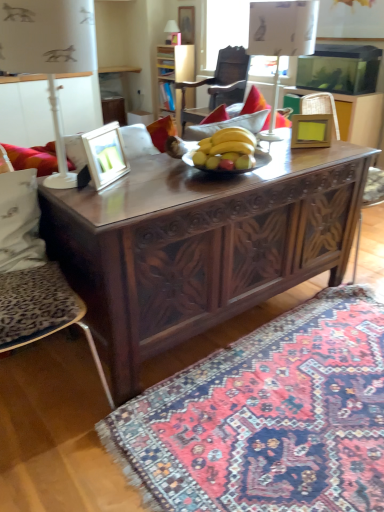
Question: Is white plastic lamp at left, placed as the 3th lamp when sorted from back to front, wider than carpet with intricate patterns at lower right?

Choices:
 (A) yes
 (B) no

Answer: (B)

Question: Is carpet with intricate patterns at lower right at the back of white plastic lamp at left, which appears as the 1th lamp when viewed from the front?

Choices:
 (A) yes
 (B) no

Answer: (B)

Question: Would you say white plastic lamp at left, placed as the 3th lamp when sorted from back to front, contains carpet with intricate patterns at lower right?

Choices:
 (A) yes
 (B) no

Answer: (B)

Question: From a real-world perspective, is white plastic lamp at left, which ranks as the third lamp in top-to-bottom order, on top of carpet with intricate patterns at lower right?

Choices:
 (A) yes
 (B) no

Answer: (A)

Question: Considering the relative positions of white plastic lamp at left, which ranks as the third lamp in top-to-bottom order, and carpet with intricate patterns at lower right in the image provided, is white plastic lamp at left, which ranks as the third lamp in top-to-bottom order, behind carpet with intricate patterns at lower right?

Choices:
 (A) no
 (B) yes

Answer: (B)

Question: Does white plastic lamp at left, which ranks as the third lamp in top-to-bottom order, touch carpet with intricate patterns at lower right?

Choices:
 (A) yes
 (B) no

Answer: (B)

Question: Is wooden chair at center, which appears as the second chair when ordered from the bottom, closer to the viewer compared to matte white lampshade at upper center, acting as the second lamp starting from the left?

Choices:
 (A) no
 (B) yes

Answer: (B)

Question: Can you confirm if wooden chair at center, which ranks as the 1th chair in back-to-front order, is shorter than matte white lampshade at upper center, positioned as the 3th lamp in bottom-to-top order?

Choices:
 (A) no
 (B) yes

Answer: (A)

Question: Is wooden chair at center, arranged as the 2th chair when viewed from the front, to the right of matte white lampshade at upper center, positioned as the 3th lamp in bottom-to-top order, from the viewer's perspective?

Choices:
 (A) yes
 (B) no

Answer: (A)

Question: Is wooden chair at center, which appears as the second chair when viewed from the left, not within matte white lampshade at upper center, which is the first lamp in back-to-front order?

Choices:
 (A) no
 (B) yes

Answer: (B)

Question: Does wooden chair at center, which appears as the second chair when viewed from the left, have a greater width compared to matte white lampshade at upper center, acting as the second lamp starting from the left?

Choices:
 (A) yes
 (B) no

Answer: (A)

Question: From a real-world perspective, is wooden chair at center, arranged as the 2th chair when viewed from the front, on top of matte white lampshade at upper center, which appears as the 2th lamp when viewed from the right?

Choices:
 (A) yes
 (B) no

Answer: (B)

Question: Is wooden picture frame at upper center, the 2th picture frame from the left, surrounded by white fabric pillow at left?

Choices:
 (A) no
 (B) yes

Answer: (A)